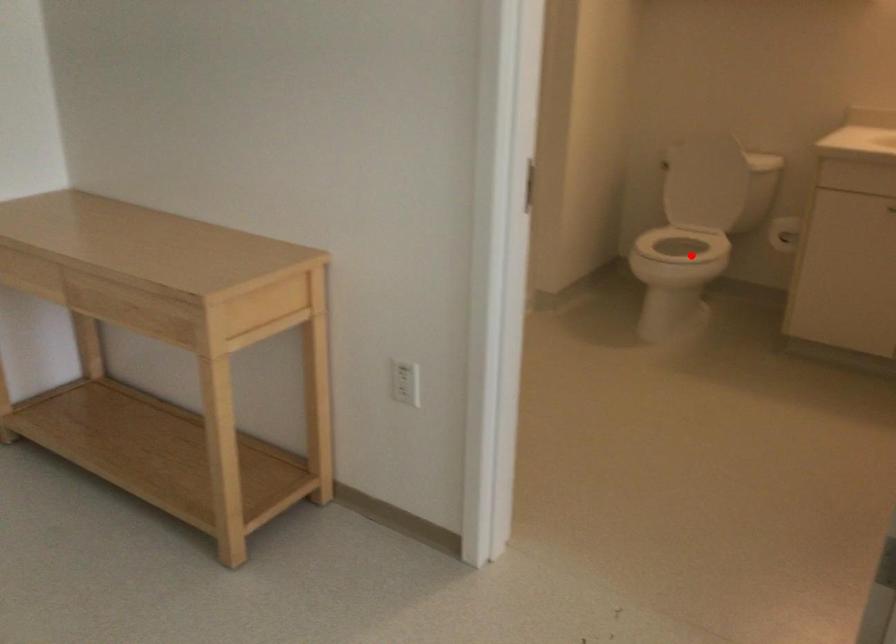
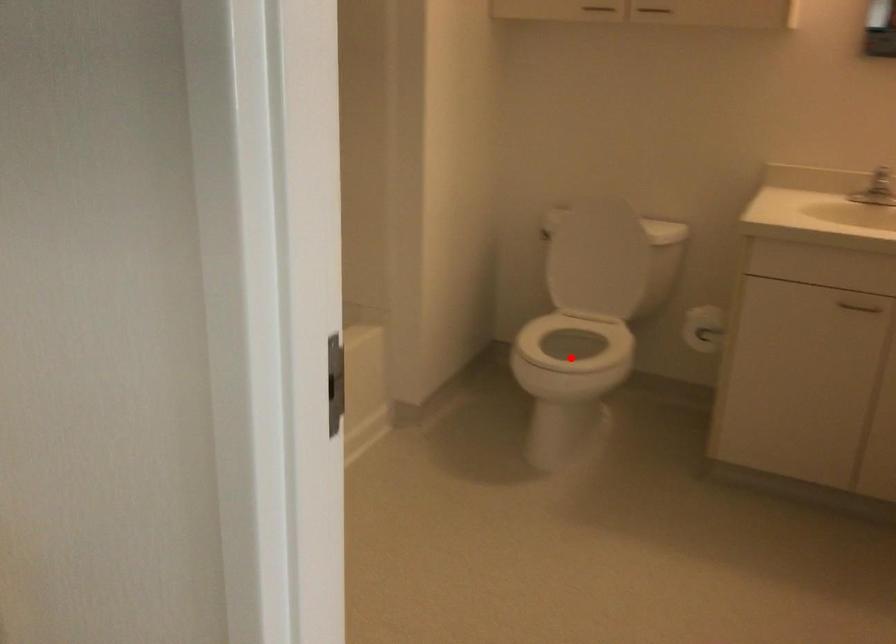
I am providing you with two images of the same scene from different viewpoints. A red point is marked on the first image and another point is marked on the second image. Is the red point in image1 aligned with the point shown in image2?

Yes